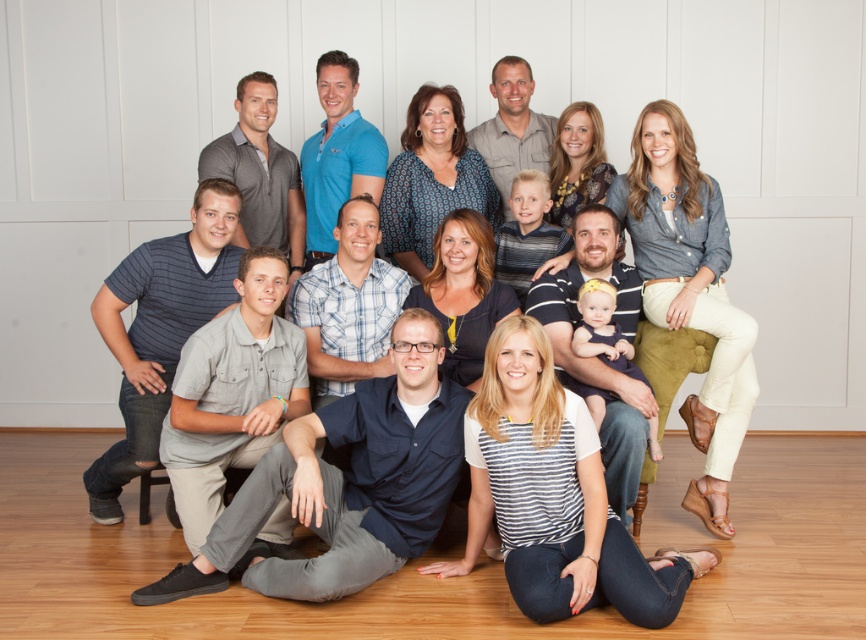
Is the position of dark blue shirt at center more distant than that of matte blue shirt at center?

No, it is in front of matte blue shirt at center.

Does dark blue shirt at center have a lesser width compared to matte blue shirt at center?

Indeed, dark blue shirt at center has a lesser width compared to matte blue shirt at center.

The image size is (866, 640). In order to click on dark blue shirt at center in this screenshot , I will do `click(346, 484)`.